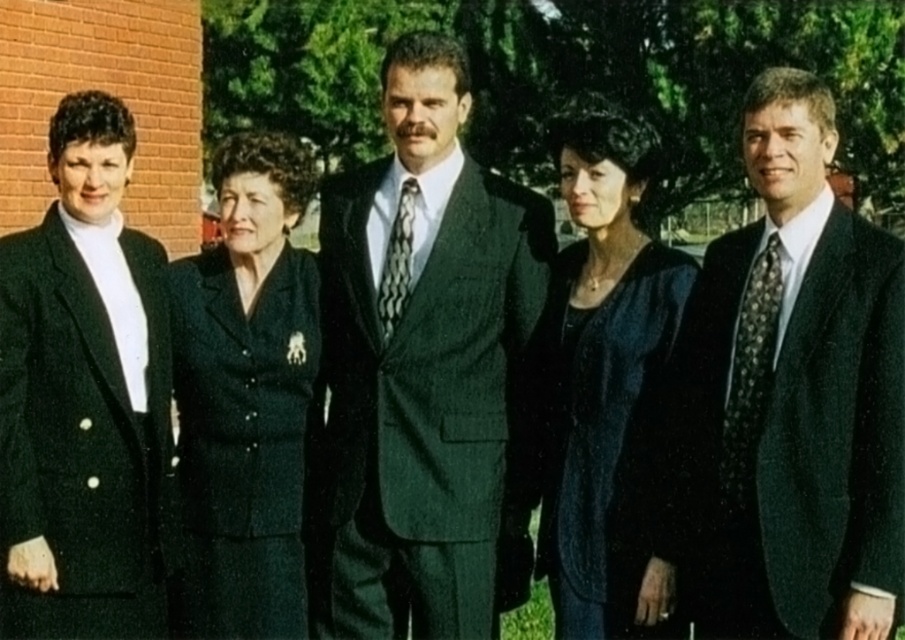
You are a photographer standing in front of the group. You want to take a photo that includes both the dark green suit at center and the black dotted tie at right. Which of the two should you focus on first to ensure both are in sharp focus?

The dark green suit at center is closer to you than the black dotted tie at right. To ensure both are in sharp focus, you should focus on the dark green suit at center first, as it is closer, and the depth of field will naturally include the black dotted tie at right which is farther away.

Consider the image. You are a photographer trying to capture a group photo of the dark green suit at center and the dark green textured suit at center. Which one should you focus on first if you want to ensure both are in frame without moving the camera?

The dark green textured suit at center is smaller in size than the dark green suit at center, so focusing on the larger dark green suit at center first will ensure both fit within the frame.